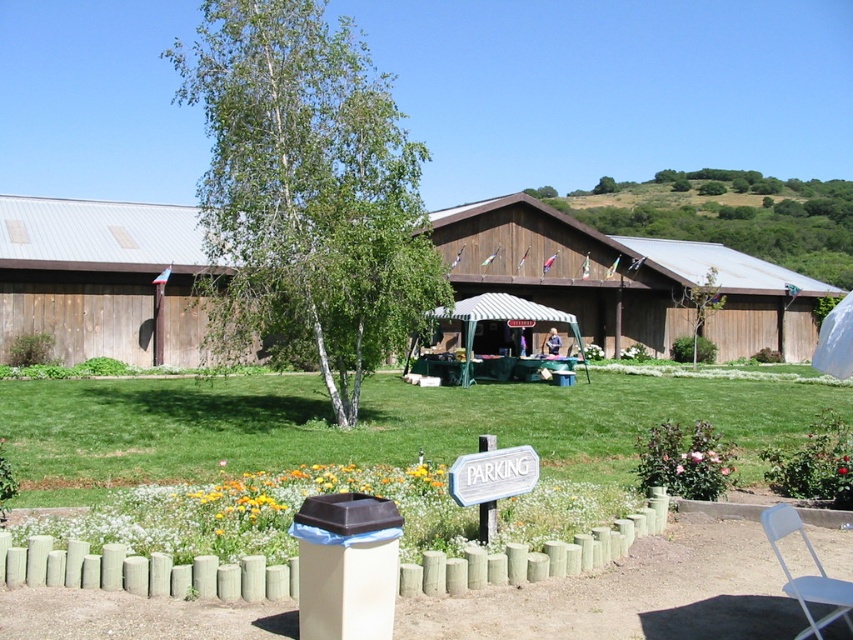
Can you confirm if brown wooden barn at center is taller than green leafy tree at upper center?

In fact, brown wooden barn at center may be shorter than green leafy tree at upper center.

Can you confirm if brown wooden barn at center is positioned to the left of green leafy tree at upper center?

Correct, you'll find brown wooden barn at center to the left of green leafy tree at upper center.

Image resolution: width=853 pixels, height=640 pixels. What are the coordinates of `brown wooden barn at center` in the screenshot? It's located at (624, 278).

Between green grass at lower center and green wooden fence at lower center, which one has more height?

Standing taller between the two is green grass at lower center.

Consider the image. Does green grass at lower center appear on the right side of green wooden fence at lower center?

No, green grass at lower center is not to the right of green wooden fence at lower center.

You are a GUI agent. You are given a task and a screenshot of the screen. Output one action in this format:
    pyautogui.click(x=<x>, y=<y>)
    Task: Click on the green grass at lower center
    This screenshot has height=640, width=853.
    Given the screenshot: What is the action you would take?
    pyautogui.click(x=372, y=426)

At what (x,y) coordinates should I click in order to perform the action: click on green grass at lower center. Please return your answer as a coordinate pair (x, y). The height and width of the screenshot is (640, 853). Looking at the image, I should click on (372, 426).

Is point (614, 205) farther from camera compared to point (846, 588)?

That is True.

Who is shorter, green leafy tree at upper center or white plastic chair at lower right?

white plastic chair at lower right

Image resolution: width=853 pixels, height=640 pixels. I want to click on green leafy tree at upper center, so click(x=728, y=214).

The width and height of the screenshot is (853, 640). Find the location of `green leafy tree at upper center`. green leafy tree at upper center is located at coordinates (728, 214).